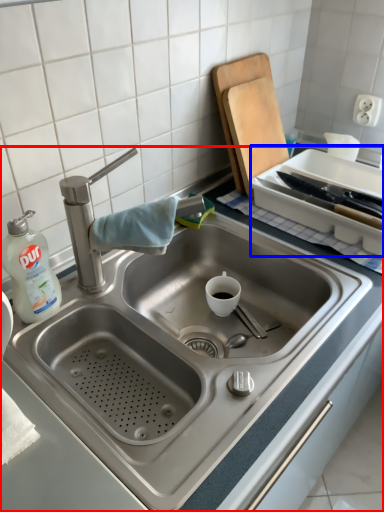
Question: Which point is further to the camera, sink (highlighted by a red box) or appliance (highlighted by a blue box)?

Choices:
 (A) sink
 (B) appliance

Answer: (B)